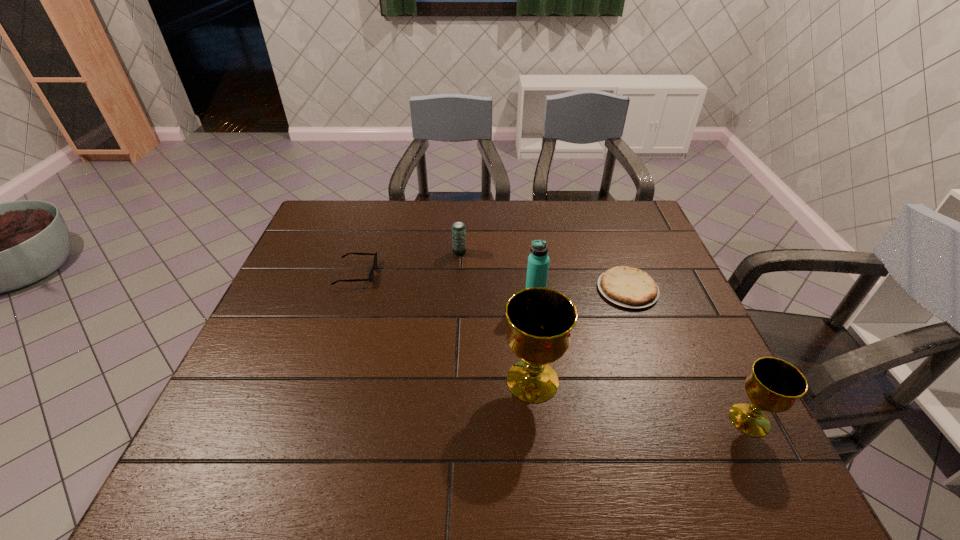
Identify the location of the leftmost object. This screenshot has width=960, height=540. (371, 274).

Locate an element on the screen. This screenshot has width=960, height=540. vacant space located 0.180m on the right of the tallest object is located at coordinates (643, 381).

At what (x,y) coordinates should I click in order to perform the action: click on vacant space situated on the left of the right chalice. Please return your answer as a coordinate pair (x, y). Looking at the image, I should click on (542, 420).

Where is `vacant area situated 0.120m on the right of the farthest object`? vacant area situated 0.120m on the right of the farthest object is located at coordinates click(x=505, y=252).

The height and width of the screenshot is (540, 960). I want to click on free space located on the right of the second tallest object, so click(679, 296).

Locate an element on the screen. This screenshot has height=540, width=960. free spot located 0.290m on the back of the fifth object from left to right is located at coordinates pyautogui.click(x=600, y=216).

Identify the location of vacant space located on the front-facing side of the fifth tallest object. Image resolution: width=960 pixels, height=540 pixels. (450, 273).

At what (x,y) coordinates should I click in order to perform the action: click on object present at the left edge. Please return your answer as a coordinate pair (x, y). This screenshot has width=960, height=540. Looking at the image, I should click on (371, 274).

Image resolution: width=960 pixels, height=540 pixels. What are the coordinates of `chalice at the right edge` in the screenshot? It's located at (774, 385).

Where is `tortilla present at the right edge`? tortilla present at the right edge is located at coordinates (629, 287).